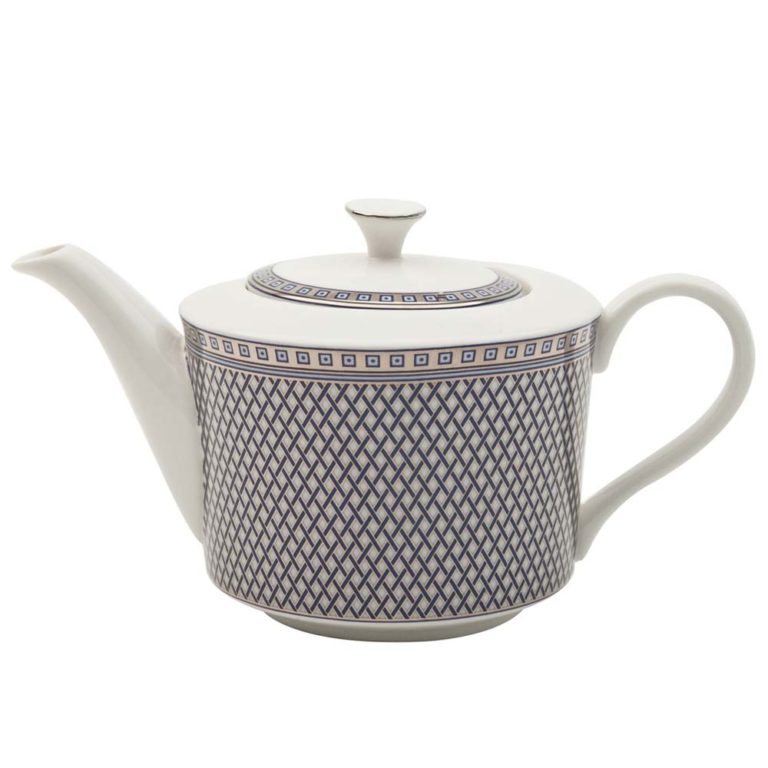
The width and height of the screenshot is (768, 768). Identify the location of teapot. (482, 482).